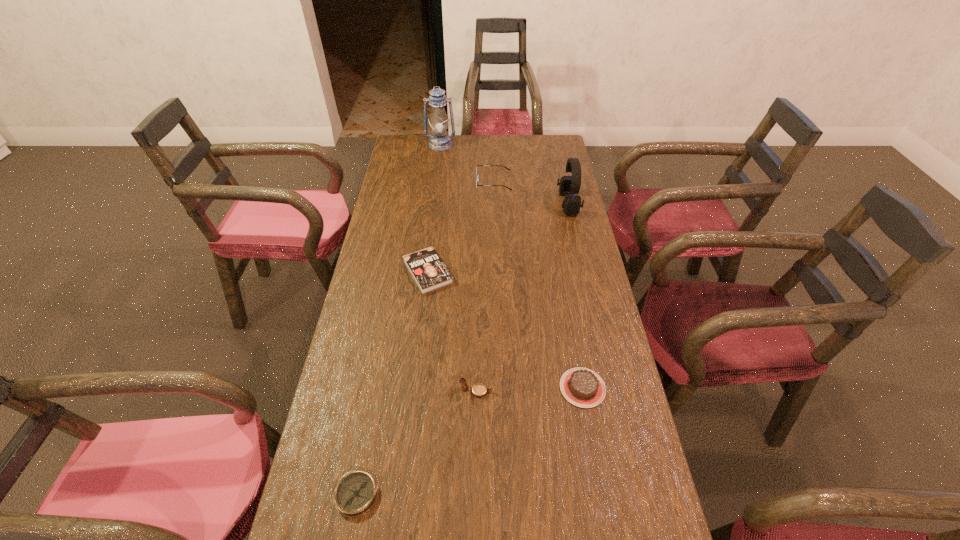
In the image, there is a desktop. Where is `free space at the left edge`? The image size is (960, 540). free space at the left edge is located at coordinates (389, 289).

At what (x,y) coordinates should I click in order to perform the action: click on vacant area at the right edge. Please return your answer as a coordinate pair (x, y). Image resolution: width=960 pixels, height=540 pixels. Looking at the image, I should click on (559, 323).

Image resolution: width=960 pixels, height=540 pixels. I want to click on free space at the far right corner of the desktop, so click(560, 148).

What are the coordinates of `vacant area between the nearest object and the second tallest object` in the screenshot? It's located at (463, 349).

You are a GUI agent. You are given a task and a screenshot of the screen. Output one action in this format:
    pyautogui.click(x=<x>, y=<y>)
    Task: Click on the free space between the spectacles and the headset
    The image size is (960, 540).
    Given the screenshot: What is the action you would take?
    pyautogui.click(x=531, y=193)

This screenshot has height=540, width=960. What are the coordinates of `blank region between the farthest object and the book` in the screenshot? It's located at (434, 208).

Where is `free spot between the fifth tallest object and the tallest object`? free spot between the fifth tallest object and the tallest object is located at coordinates (512, 266).

Image resolution: width=960 pixels, height=540 pixels. In order to click on free spot between the book and the spectacles in this screenshot , I will do `click(461, 227)`.

Find the location of a particular element. Image resolution: width=960 pixels, height=540 pixels. free space between the nearer compass and the spectacles is located at coordinates (425, 338).

The width and height of the screenshot is (960, 540). In order to click on vacant point located between the left compass and the farthest object in this screenshot , I will do `click(398, 319)`.